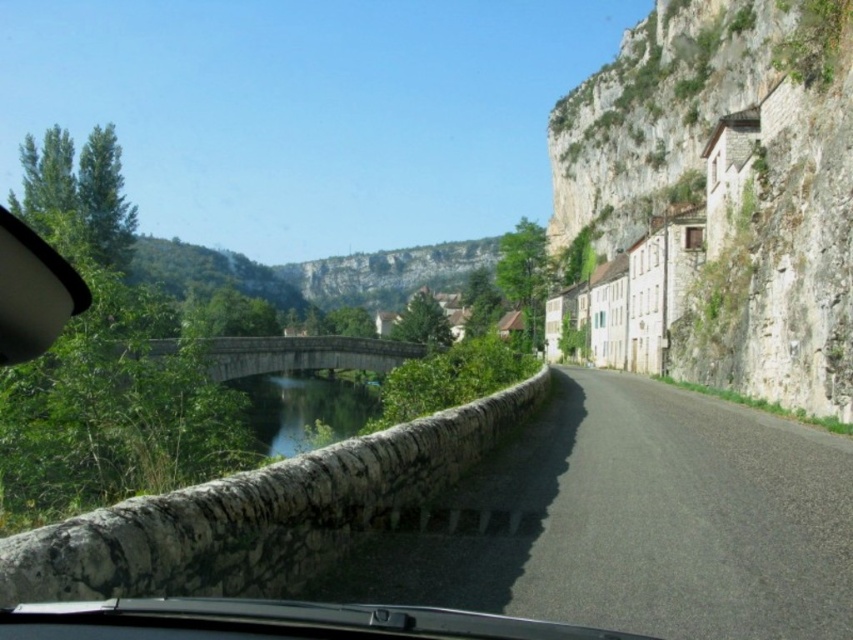
You are driving a car that is 5 meters long. You see the clear water at bridge center and the stone bridge at center ahead on the road. Can your car pass through the gap between them without touching either?

The distance between the clear water at bridge center and the stone bridge at center is 16.00 meters, which is greater than the car length of 5 meters. Therefore, the car can pass through the gap without touching either.

You are driving a car and want to know if the asphalt road at center can fit entirely within the transparent plastic car window at upper left when viewed from your current position. Based on their sizes, what do you think?

The asphalt road at center is wider than the transparent plastic car window at upper left, so it cannot fit entirely within the window.